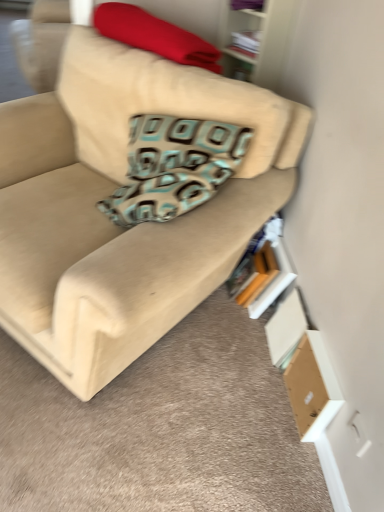
Question: Is brown cardboard box at lower right spatially inside wooden bookshelf at upper right, or outside of it?

Choices:
 (A) outside
 (B) inside

Answer: (A)

Question: Considering the positions of brown cardboard box at lower right and wooden bookshelf at upper right in the image, is brown cardboard box at lower right taller or shorter than wooden bookshelf at upper right?

Choices:
 (A) tall
 (B) short

Answer: (B)

Question: Estimate the real-world distances between objects in this image. Which object is farther from the hardcover book at lower right, positioned as the 2th book in top-to-bottom order?

Choices:
 (A) wooden bookshelf at upper right
 (B) beige fabric couch at center
 (C) red fabric blanket at upper center
 (D) brown cardboard box at lower right
 (E) white paper book at upper center, arranged as the 2th book when ordered from the bottom

Answer: (E)

Question: Which object is positioned farthest from the white paper book at upper center, arranged as the 2th book when ordered from the bottom?

Choices:
 (A) red fabric blanket at upper center
 (B) brown cardboard box at lower right
 (C) wooden bookshelf at upper right
 (D) beige fabric couch at center
 (E) hardcover book at lower right, positioned as the 2th book in top-to-bottom order

Answer: (B)